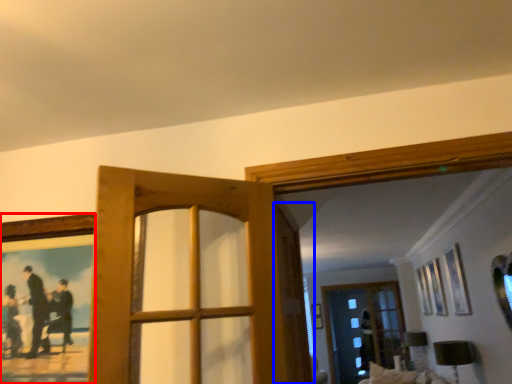
Question: Which of the following is the closest to the observer, picture frame (highlighted by a red box) or screen door (highlighted by a blue box)?

Choices:
 (A) picture frame
 (B) screen door

Answer: (A)